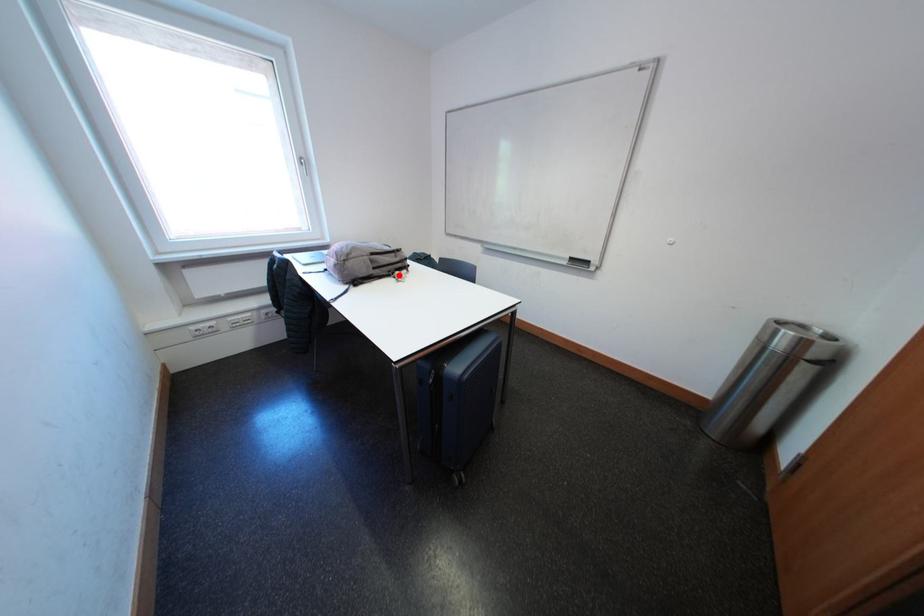
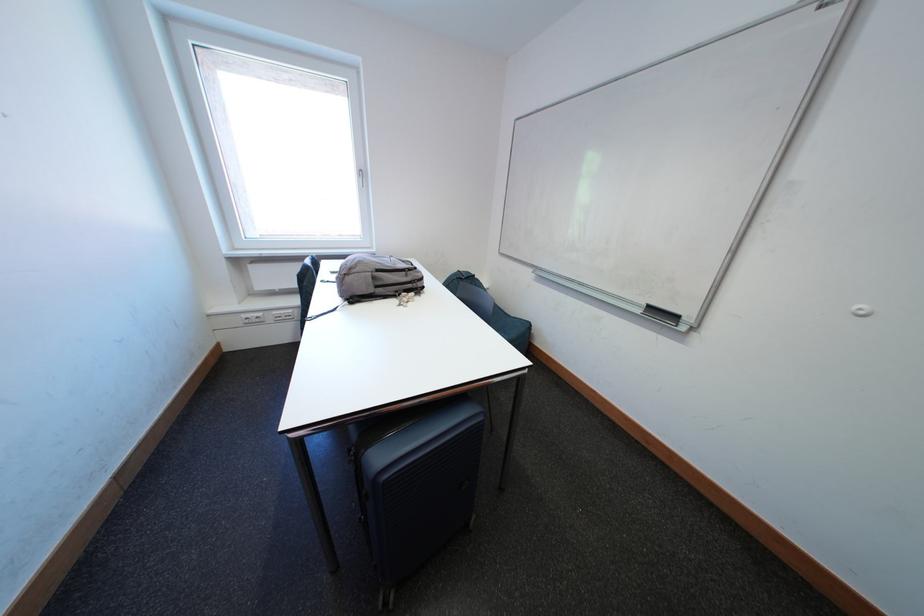
The point at the highlighted location is marked in the first image. Where is the corresponding point in the second image?

(406, 294)